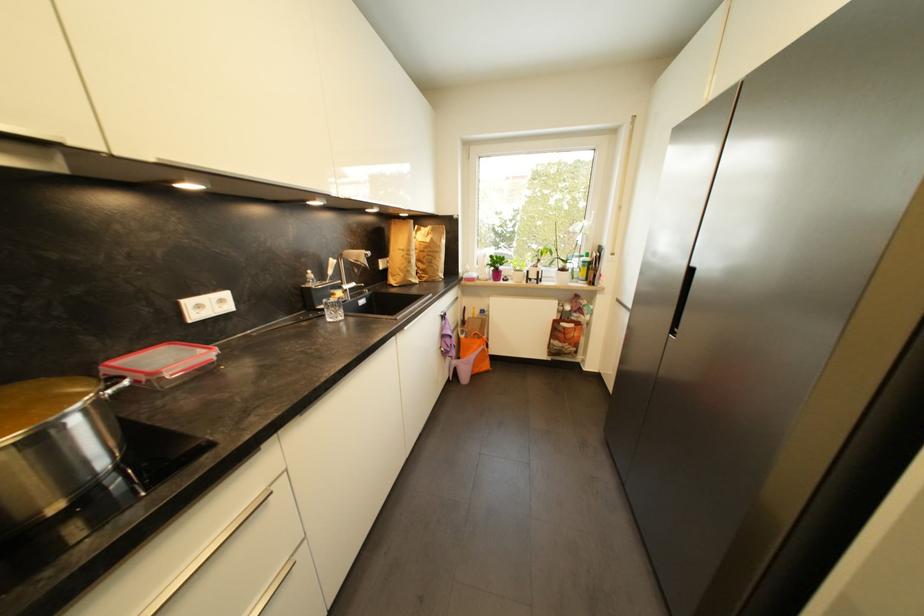
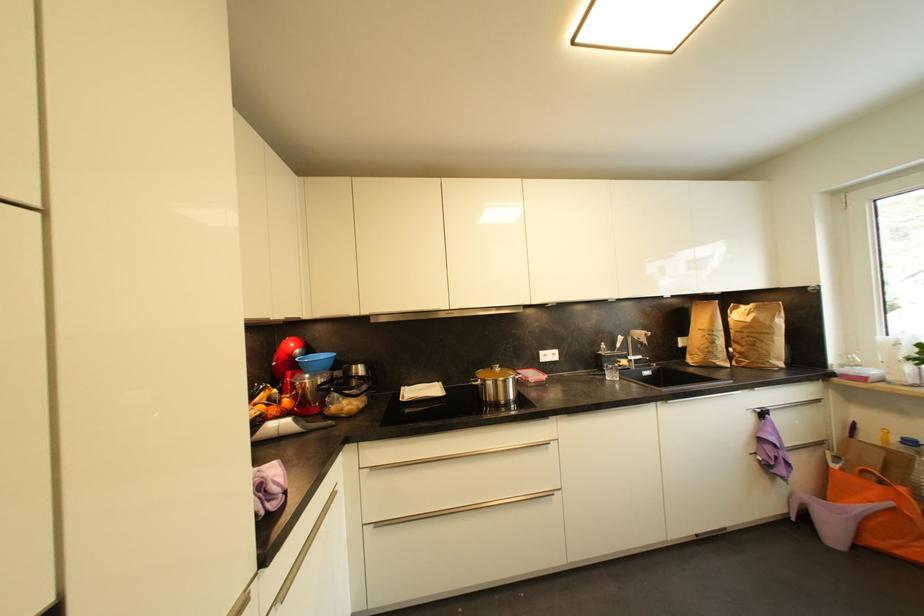
Find the pixel in the second image that matches point (136, 354) in the first image.

(528, 371)